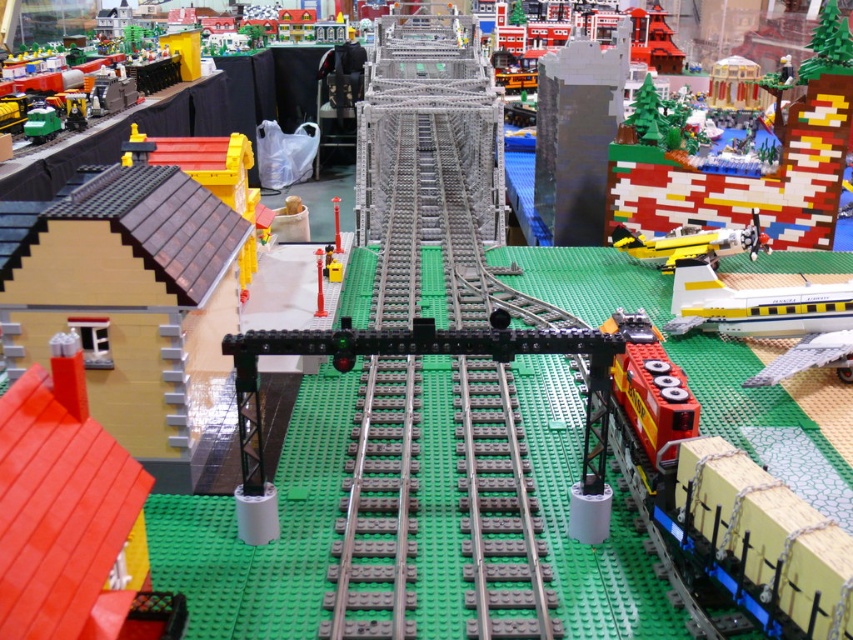
Looking at this image, you are standing at the point marked as point (71,516) in the Lego cityscape. Looking around, you see a smooth red roof at left. Which direction should you face to see the smooth red roof at left?

You should face to the left to see the smooth red roof at left located at point (71,516).

You are a Lego designer trying to fit both the brick wall at upper right and the yellow matte airplane at upper right onto a new Lego baseplate. Given that the baseplate has limited space, which object should you place first to ensure both fit properly?

The brick wall at upper right should be placed first because it is wider than the yellow matte airplane at upper right, allowing you to position it in the available space first before placing the smaller airplane.